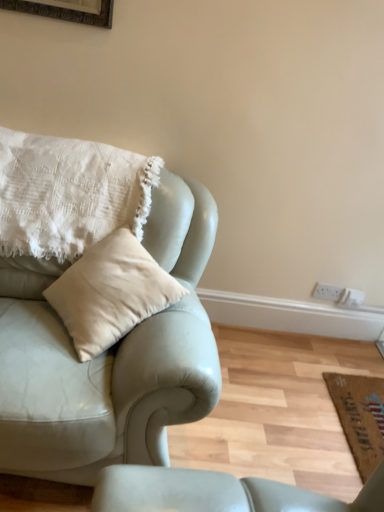
This screenshot has width=384, height=512. Find the location of `vacant position to the left of brown woven mat at lower right`. vacant position to the left of brown woven mat at lower right is located at coordinates (299, 407).